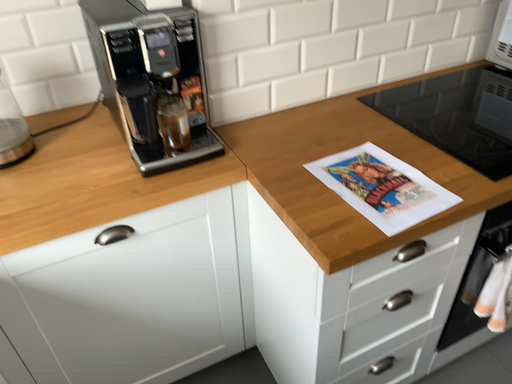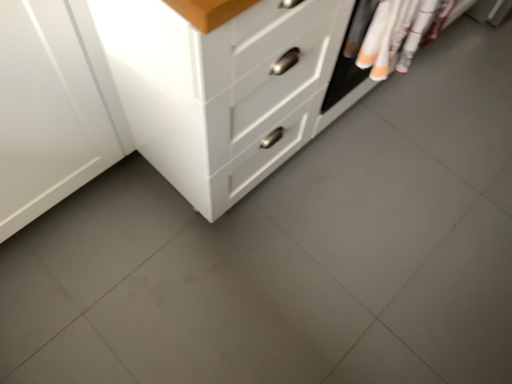
Question: How did the camera likely rotate when shooting the video?

Choices:
 (A) rotated left
 (B) rotated right

Answer: (B)